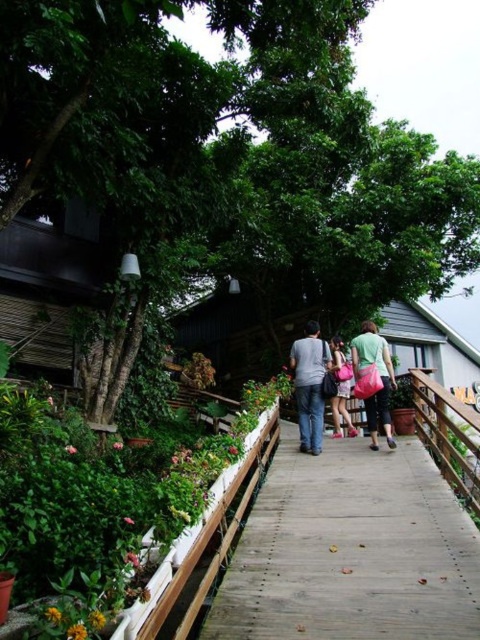
You are standing on the wooden walkway and want to place both the denim jeans at center and the pink fabric bag at center on the white planter box. Since the planter box has limited space, which item should you place first to ensure both can fit?

The denim jeans at center has a lesser width compared to the pink fabric bag at center, so you should place the pink fabric bag at center first to accommodate its larger size, then the denim jeans at center can fit alongside.

You are a tailor standing at the edge of the walkway, holding a measuring tape. You need to determine if the denim jeans at center can be altered to fit the matte green shirt at center. The minimum required distance between the two items for proper alteration is 20 inches. Can you proceed with the alterations?

The distance between denim jeans at center and matte green shirt at center is 19.61 inches, which is less than the required 20 inches. Therefore, the alterations cannot be done properly at this time.